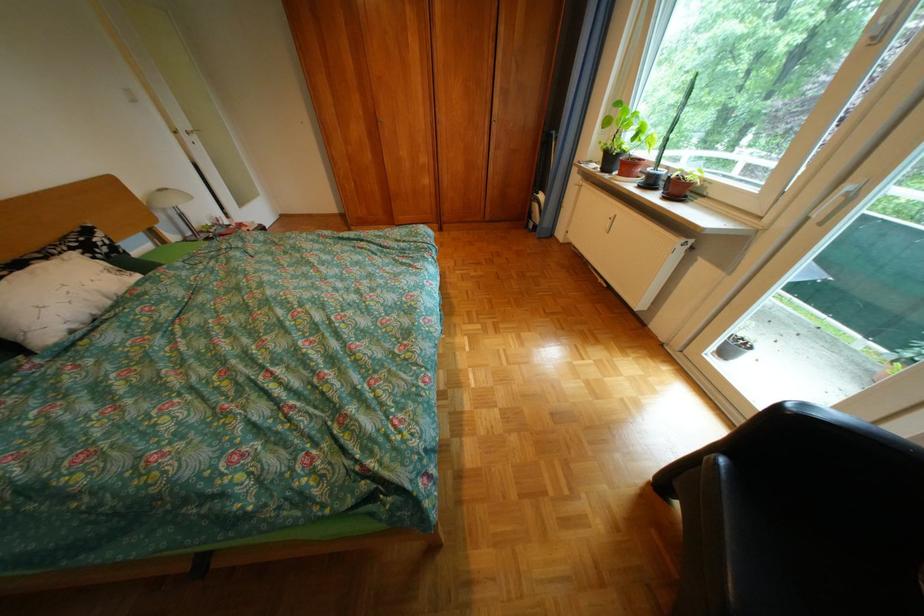
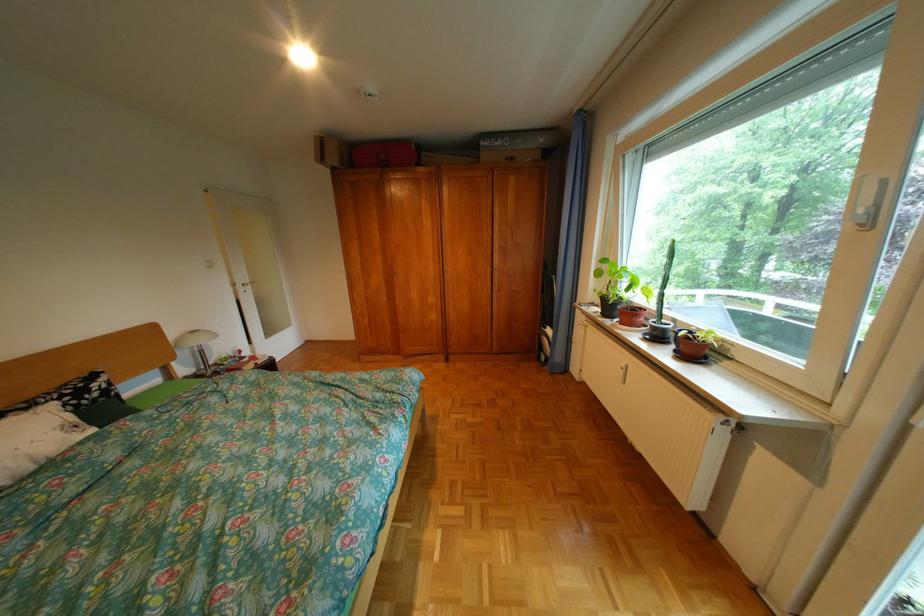
In the second image, find the point that corresponds to point 372,131 in the first image.

(392, 280)